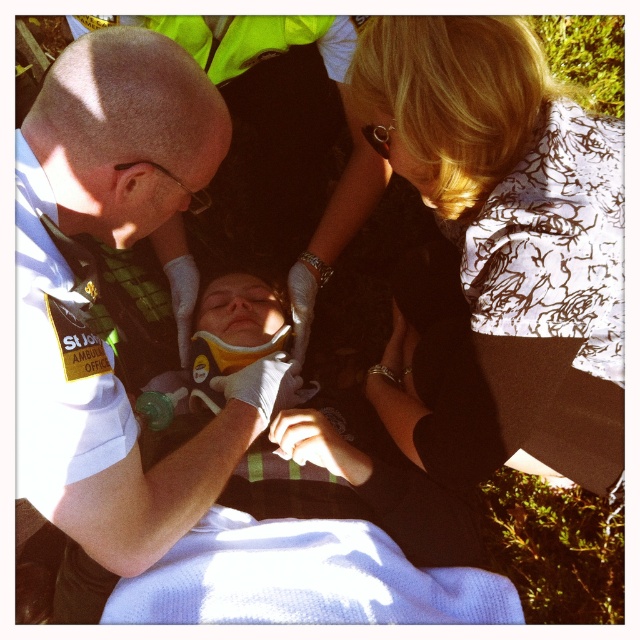
Which of these two, blonde hair at upper right or white matte uniform at center, stands taller?

white matte uniform at center

Is point (529, 246) less distant than point (113, 520)?

Yes, it is in front of point (113, 520).

Locate an element on the screen. This screenshot has height=640, width=640. blonde hair at upper right is located at coordinates (513, 228).

What are the coordinates of `blonde hair at upper right` in the screenshot? It's located at (513, 228).

How distant is blonde hair at upper right from yellow soft plastic at center?

A distance of 16.29 inches exists between blonde hair at upper right and yellow soft plastic at center.

Which is behind, point (492, 284) or point (296, 468)?

The point (296, 468) is behind.

Identify the location of blonde hair at upper right. click(x=513, y=228).

Does white matte uniform at center appear under yellow soft plastic at center?

Actually, white matte uniform at center is above yellow soft plastic at center.

Which is above, white matte uniform at center or yellow soft plastic at center?

white matte uniform at center is above.

Between point (42, 320) and point (323, 481), which one is positioned in front?

Point (42, 320)

I want to click on white matte uniform at center, so click(76, 292).